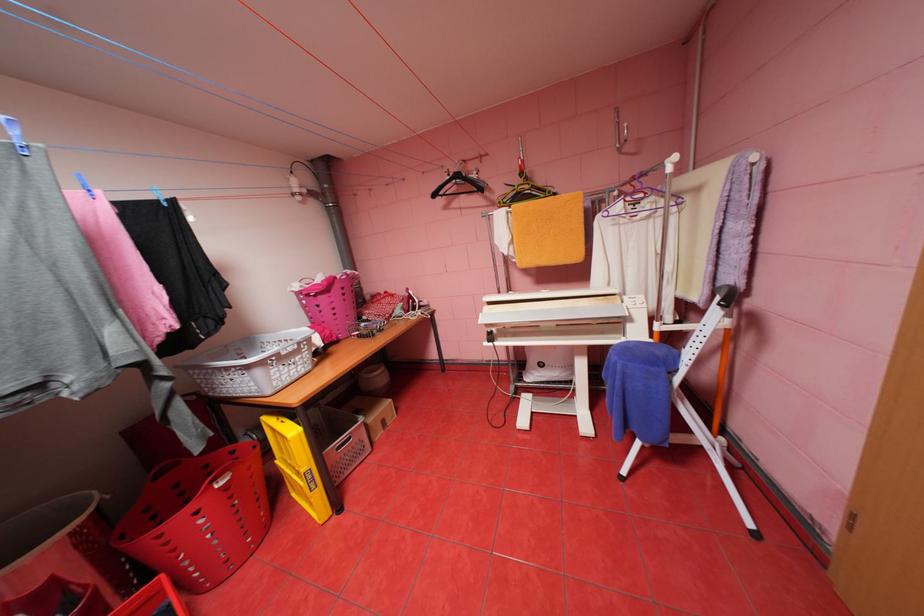
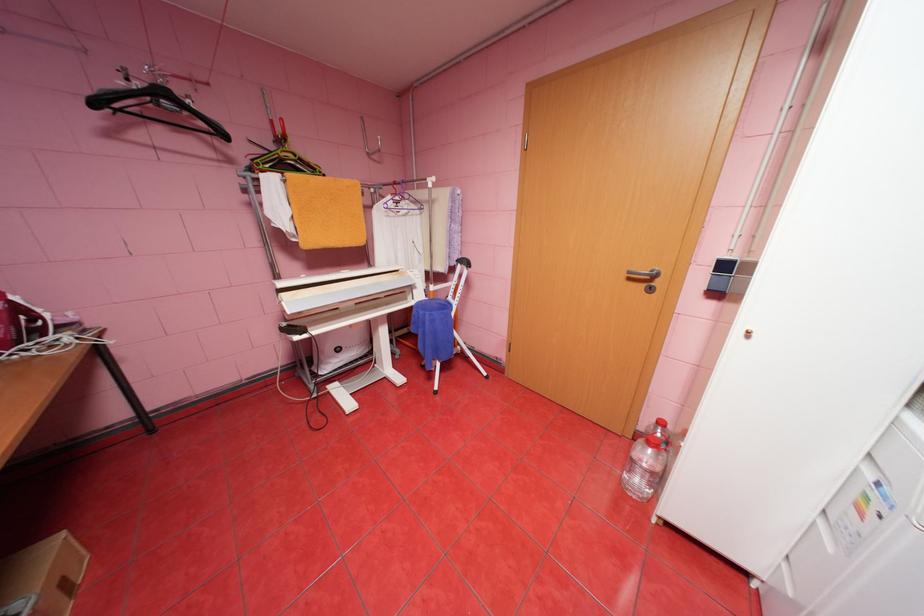
In the second image, find the point that corresponds to [419,297] in the first image.

(26, 309)